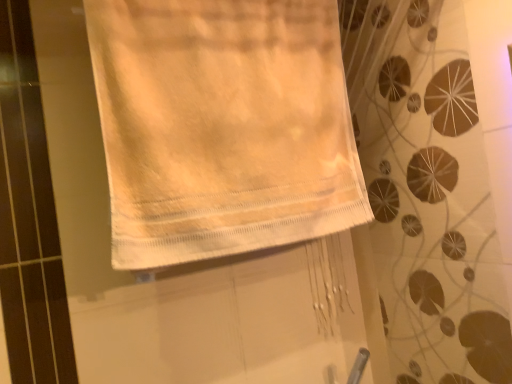
The height and width of the screenshot is (384, 512). What do you see at coordinates (222, 126) in the screenshot?
I see `white cotton towel at upper left` at bounding box center [222, 126].

Identify the location of white cotton towel at upper left. The width and height of the screenshot is (512, 384). (222, 126).

The width and height of the screenshot is (512, 384). I want to click on white cotton towel at upper left, so click(x=222, y=126).